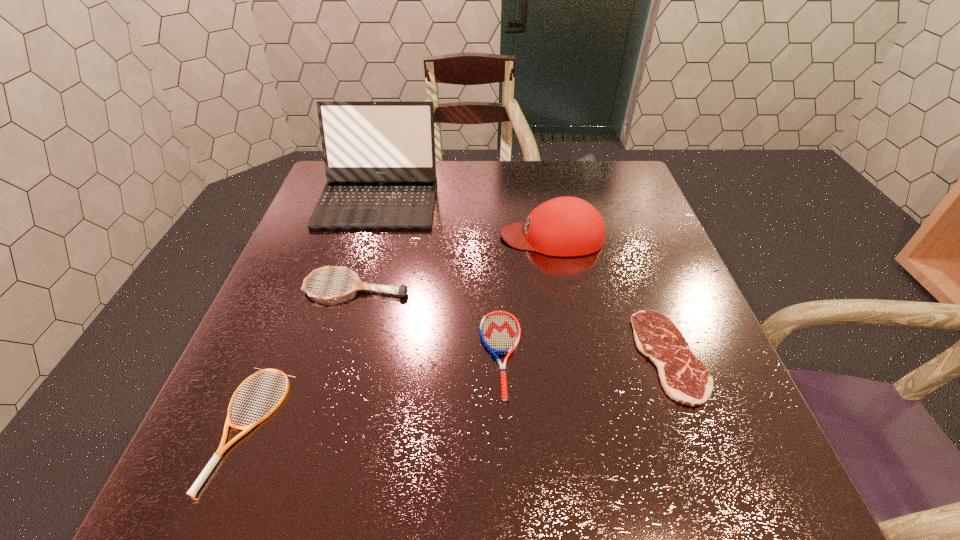
Where is `laptop`? The image size is (960, 540). laptop is located at coordinates (379, 156).

In order to click on baseball cap in this screenshot , I will do `click(566, 226)`.

The height and width of the screenshot is (540, 960). In order to click on the third tallest object in this screenshot , I will do `click(401, 290)`.

Identify the location of the fourth nearest object. The width and height of the screenshot is (960, 540). (401, 290).

Find the location of `steak`. steak is located at coordinates (684, 378).

Where is `the rightmost tennis racket`? the rightmost tennis racket is located at coordinates (500, 331).

Where is `free space located 0.090m on the surface of the laptop`? free space located 0.090m on the surface of the laptop is located at coordinates (363, 253).

The width and height of the screenshot is (960, 540). What are the coordinates of `free space located 0.200m on the front-facing side of the second tallest object` in the screenshot? It's located at tap(420, 237).

The image size is (960, 540). I want to click on free space located 0.210m on the front-facing side of the second tallest object, so click(416, 237).

This screenshot has width=960, height=540. In order to click on free space located on the front-facing side of the second tallest object in this screenshot , I will do `click(340, 237)`.